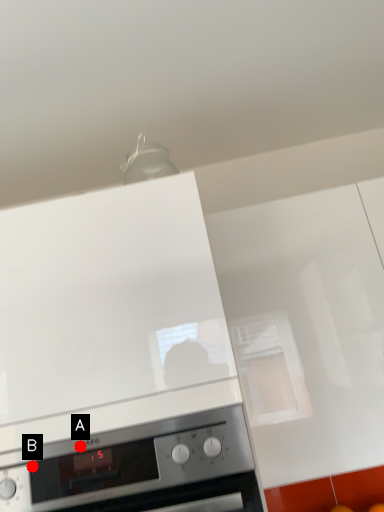
Question: Two points are circled on the image, labeled by A and B beside each circle. Which point is closer to the camera?

Choices:
 (A) A is closer
 (B) B is closer

Answer: (B)